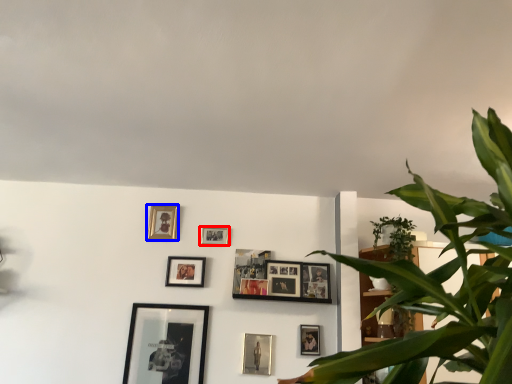
Question: Which object appears farthest to the camera in this image, picture frame (highlighted by a red box) or picture frame (highlighted by a blue box)?

Choices:
 (A) picture frame
 (B) picture frame

Answer: (B)